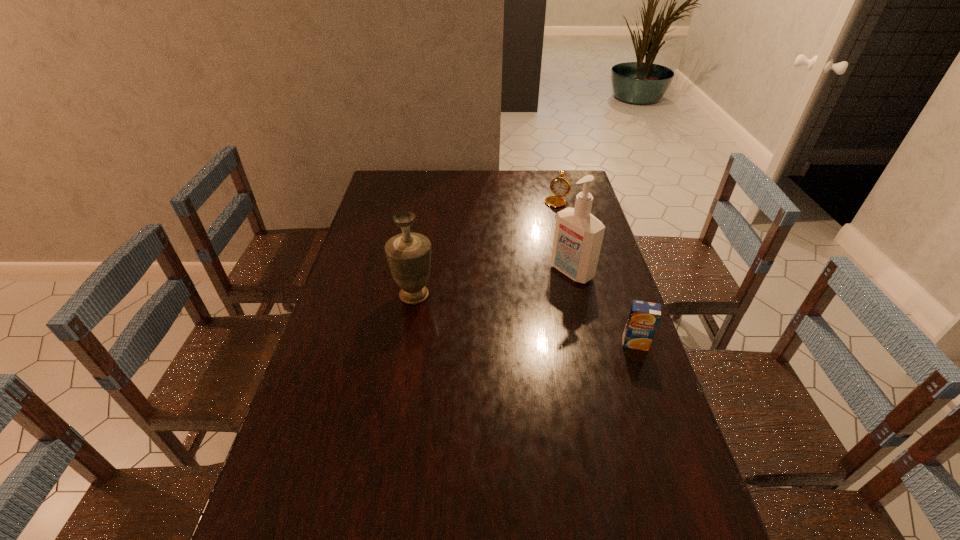
At what (x,y) coordinates should I click in order to perform the action: click on the second tallest object. Please return your answer as a coordinate pair (x, y). This screenshot has height=540, width=960. Looking at the image, I should click on (408, 254).

I want to click on the leftmost object, so click(x=408, y=254).

What are the coordinates of `orange_juice` in the screenshot? It's located at (644, 317).

Image resolution: width=960 pixels, height=540 pixels. I want to click on the shortest object, so click(x=559, y=186).

The height and width of the screenshot is (540, 960). I want to click on pocket watch, so click(559, 186).

Locate an element on the screen. This screenshot has width=960, height=540. cleansing agent is located at coordinates (578, 237).

Identify the location of vacant area situated 0.330m on the front of the leftmost object. This screenshot has height=540, width=960. (396, 403).

Where is `vacant region located on the back of the nearest object`? The width and height of the screenshot is (960, 540). vacant region located on the back of the nearest object is located at coordinates [x=609, y=267].

Locate an element on the screen. free space located on the face of the shortest object is located at coordinates (533, 245).

This screenshot has height=540, width=960. Find the location of `blank space located 0.270m on the face of the shortest object`. blank space located 0.270m on the face of the shortest object is located at coordinates (532, 246).